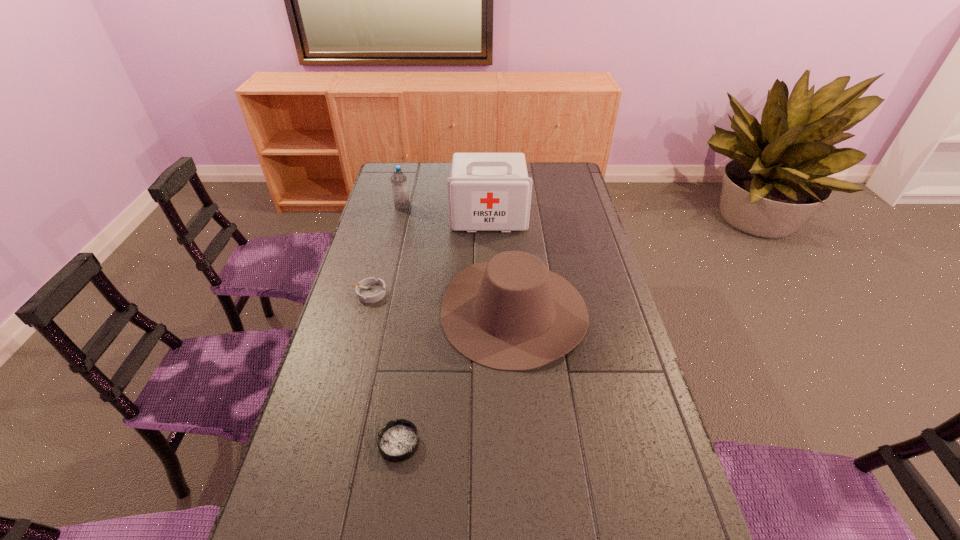
Find the location of a particular element. The width and height of the screenshot is (960, 540). vacant space located 0.280m on the right of the nearer ashtray is located at coordinates (535, 443).

Identify the location of water bottle located at the left edge. (398, 179).

Identify the location of ashtray that is at the left edge. (369, 290).

At what (x,y) coordinates should I click in order to perform the action: click on object situated at the right edge. Please return your answer as a coordinate pair (x, y). Looking at the image, I should click on (511, 313).

Image resolution: width=960 pixels, height=540 pixels. Identify the location of free space at the left edge of the desktop. (406, 220).

Identify the location of vacant space at the right edge of the desktop. The width and height of the screenshot is (960, 540). (667, 497).

Where is `free location at the far left corner of the desktop`? free location at the far left corner of the desktop is located at coordinates (409, 182).

Where is `free space at the far right corner of the desktop`? This screenshot has width=960, height=540. free space at the far right corner of the desktop is located at coordinates (565, 185).

Where is `unoccupied area between the farther ashtray and the nearest object`? The image size is (960, 540). unoccupied area between the farther ashtray and the nearest object is located at coordinates (384, 368).

The image size is (960, 540). I want to click on free space between the water bottle and the farther ashtray, so click(386, 250).